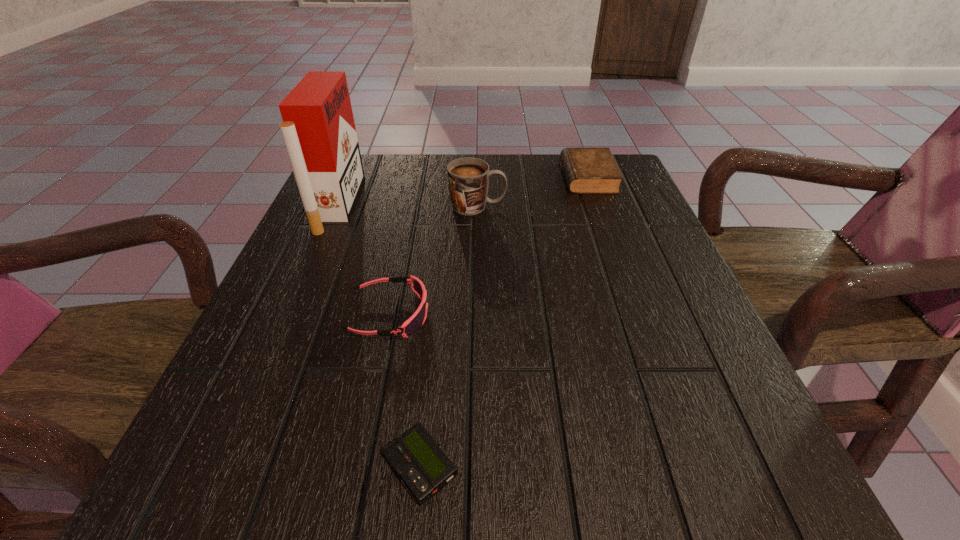
At what (x,y) coordinates should I click in order to perform the action: click on the tallest object. Please return your answer as a coordinate pair (x, y). The height and width of the screenshot is (540, 960). Looking at the image, I should click on (318, 129).

Where is `cigarette case`? Image resolution: width=960 pixels, height=540 pixels. cigarette case is located at coordinates (318, 129).

Image resolution: width=960 pixels, height=540 pixels. I want to click on the second tallest object, so (468, 178).

Identify the location of goggles. The image size is (960, 540). (413, 324).

Image resolution: width=960 pixels, height=540 pixels. Find the location of `diary`. diary is located at coordinates (587, 170).

I want to click on the shortest object, so tap(416, 458).

At what (x,y) coordinates should I click in order to perform the action: click on the nearest object. Please return your answer as a coordinate pair (x, y). This screenshot has width=960, height=540. Looking at the image, I should click on (416, 458).

Where is `vacant space situated on the front-facing side of the cigarette case`? This screenshot has height=540, width=960. vacant space situated on the front-facing side of the cigarette case is located at coordinates (505, 204).

Where is `free space located 0.120m on the side of the mug with the handle`? The image size is (960, 540). free space located 0.120m on the side of the mug with the handle is located at coordinates (557, 206).

Find the location of a particular element. This screenshot has height=540, width=960. free space located on the front-facing side of the fourth farthest object is located at coordinates (457, 315).